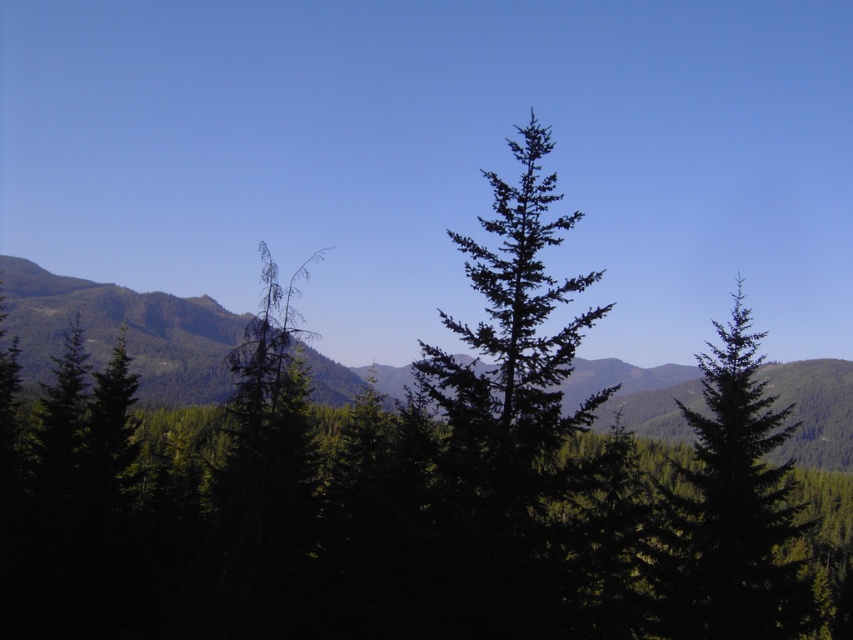
Does green textured forest at center come in front of green matte tree at center?

No, it is behind green matte tree at center.

This screenshot has width=853, height=640. Describe the element at coordinates (126, 332) in the screenshot. I see `green textured forest at center` at that location.

This screenshot has width=853, height=640. Find the location of `green textured forest at center`. green textured forest at center is located at coordinates (126, 332).

Where is `green textured forest at center`? This screenshot has height=640, width=853. green textured forest at center is located at coordinates (126, 332).